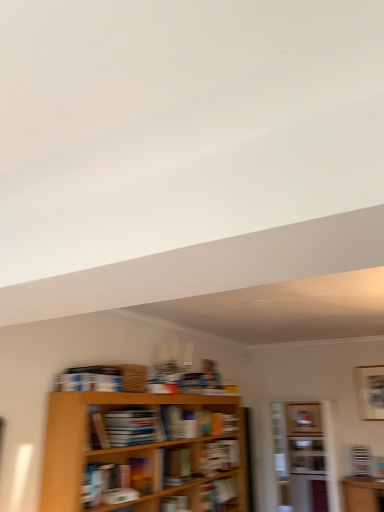
Question: Does hardcover book at center, the sixth book viewed from the right, have a lesser width compared to matte brown book at center, which ranks as the 4th book in back-to-front order?

Choices:
 (A) no
 (B) yes

Answer: (A)

Question: Is hardcover book at center, arranged as the first book when viewed from the front, at the left side of matte brown book at center, which ranks as the 4th book in back-to-front order?

Choices:
 (A) no
 (B) yes

Answer: (B)

Question: From the image's perspective, would you say hardcover book at center, which is the 1th book from left to right, is shown under matte brown book at center, which ranks as the 4th book in back-to-front order?

Choices:
 (A) yes
 (B) no

Answer: (B)

Question: Does hardcover book at center, which is the 1th book from left to right, have a greater width compared to matte brown book at center, the 4th book positioned from the right?

Choices:
 (A) no
 (B) yes

Answer: (B)

Question: Is point (180, 476) positioned closer to the camera than point (201, 502)?

Choices:
 (A) farther
 (B) closer

Answer: (B)

Question: Would you say matte brown book at center, which appears as the third book when viewed from the front, is to the left or to the right of hardcover book at center, placed as the 3th book when sorted from back to front, in the picture?

Choices:
 (A) left
 (B) right

Answer: (A)

Question: Do you think matte brown book at center, which ranks as the 4th book in back-to-front order, is within hardcover book at center, placed as the 3th book when sorted from back to front, or outside of it?

Choices:
 (A) inside
 (B) outside

Answer: (B)

Question: In terms of height, does matte brown book at center, which appears as the third book when viewed from the front, look taller or shorter compared to hardcover book at center, placed as the 3th book when sorted from back to front?

Choices:
 (A) short
 (B) tall

Answer: (B)

Question: From a real-world perspective, is wooden bookshelf at center positioned above or below white glossy cabinet at center?

Choices:
 (A) above
 (B) below

Answer: (A)

Question: Considering the positions of wooden bookshelf at center and white glossy cabinet at center in the image, is wooden bookshelf at center wider or thinner than white glossy cabinet at center?

Choices:
 (A) thin
 (B) wide

Answer: (B)

Question: From the image's perspective, relative to white glossy cabinet at center, is wooden bookshelf at center above or below?

Choices:
 (A) above
 (B) below

Answer: (A)

Question: Based on their sizes in the image, would you say wooden bookshelf at center is bigger or smaller than white glossy cabinet at center?

Choices:
 (A) big
 (B) small

Answer: (A)

Question: From the image's perspective, is white glossy cabinet at center positioned above or below matte black bookshelf at lower right, the first book from the back?

Choices:
 (A) above
 (B) below

Answer: (B)

Question: Based on their sizes in the image, would you say white glossy cabinet at center is bigger or smaller than matte black bookshelf at lower right, the 1th book viewed from the right?

Choices:
 (A) big
 (B) small

Answer: (B)